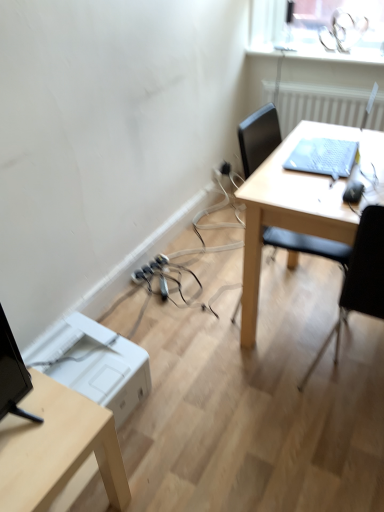
In order to click on vacant space in front of white textured radiator at upper right in this screenshot , I will do `click(333, 188)`.